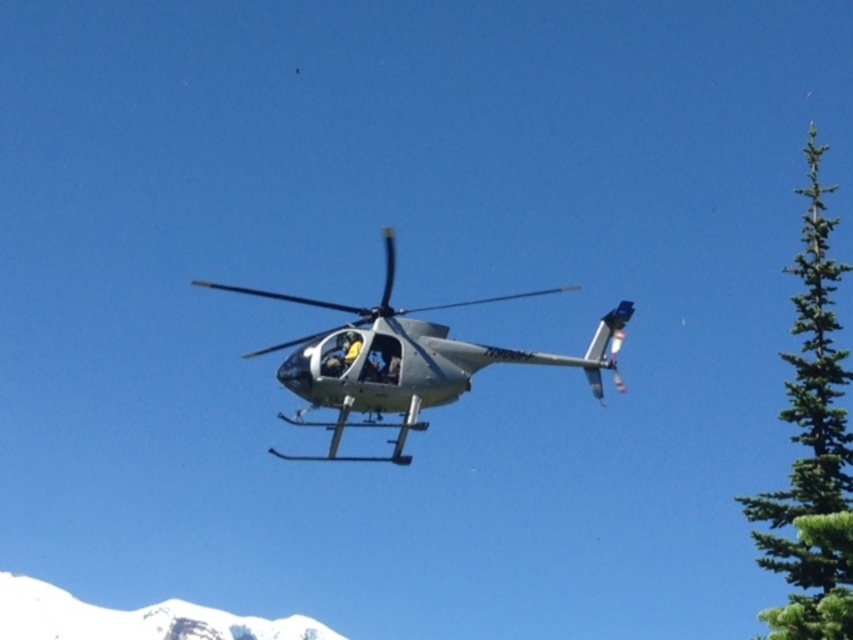
Question: Which of the following is the closest to the observer?

Choices:
 (A) (799, 266)
 (B) (374, 404)

Answer: (B)

Question: Is green needle-like tree at right wider than yellow fabric skier at center?

Choices:
 (A) yes
 (B) no

Answer: (A)

Question: Which object is farther from the camera taking this photo?

Choices:
 (A) metallic silver helicopter at center
 (B) yellow fabric skier at center
 (C) green needle-like tree at right

Answer: (C)

Question: Can you confirm if green needle-like tree at right is positioned to the right of yellow fabric skier at center?

Choices:
 (A) no
 (B) yes

Answer: (B)

Question: In this image, where is metallic silver helicopter at center located relative to yellow fabric skier at center?

Choices:
 (A) right
 (B) left

Answer: (A)

Question: Among these points, which one is nearest to the camera?

Choices:
 (A) (808, 467)
 (B) (328, 355)

Answer: (B)